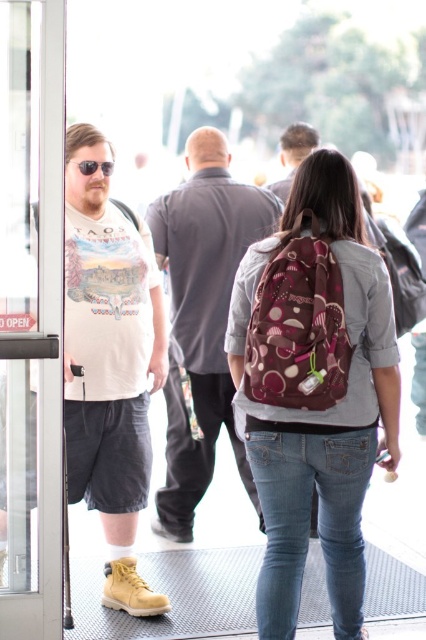
Question: Is transparent glass door at left positioned before matte white t-shirt at center?

Choices:
 (A) yes
 (B) no

Answer: (A)

Question: Is denim jeans at center wider than black plastic sunglasses at left?

Choices:
 (A) no
 (B) yes

Answer: (B)

Question: Which object is closer to the camera taking this photo?

Choices:
 (A) dark gray shirt at center
 (B) brown fabric backpack at center
 (C) black plastic sunglasses at left
 (D) transparent glass door at left

Answer: (B)

Question: Which point is farther from the camera taking this photo?

Choices:
 (A) (307, 145)
 (B) (215, 193)

Answer: (A)

Question: Does matte white t-shirt at center have a smaller size compared to black plastic sunglasses at left?

Choices:
 (A) yes
 (B) no

Answer: (B)

Question: Which of these objects is positioned farthest from the matte gray shirt at center?

Choices:
 (A) matte white t-shirt at center
 (B) dark gray shirt at center

Answer: (A)